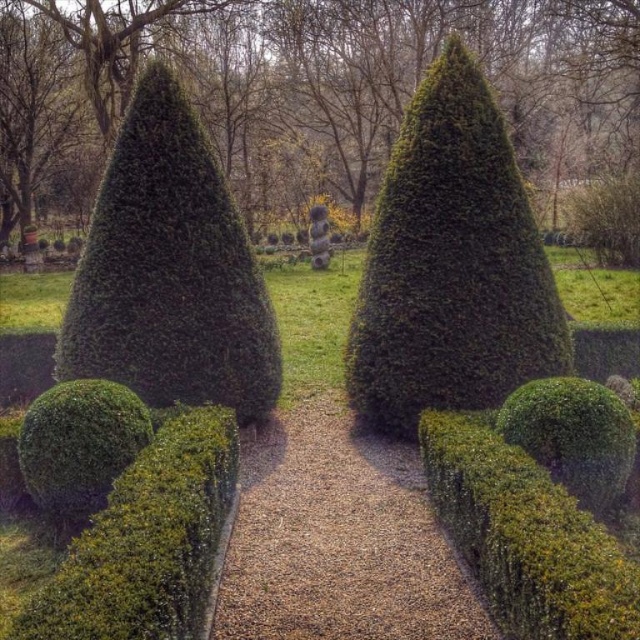
Identify the location of green leafy shrub at left. Image resolution: width=640 pixels, height=640 pixels. (170, 272).

Which is behind, point (333, 122) or point (154, 118)?

The point (333, 122) is behind.

Can you confirm if green leafy bush at center is positioned above green leafy shrub at left?

Correct, green leafy bush at center is located above green leafy shrub at left.

Between point (200, 84) and point (154, 138), which one is positioned behind?

Positioned behind is point (200, 84).

Locate an element on the screen. green leafy bush at center is located at coordinates (323, 99).

Between green textured hedge at center and green leafy shrub at left, which one appears on the right side from the viewer's perspective?

green textured hedge at center is more to the right.

Who is more distant from viewer, (353, 362) or (228, 244)?

Point (353, 362)

At what (x,y) coordinates should I click in order to perform the action: click on green textured hedge at center. Please return your answer as a coordinate pair (x, y). Looking at the image, I should click on (451, 266).